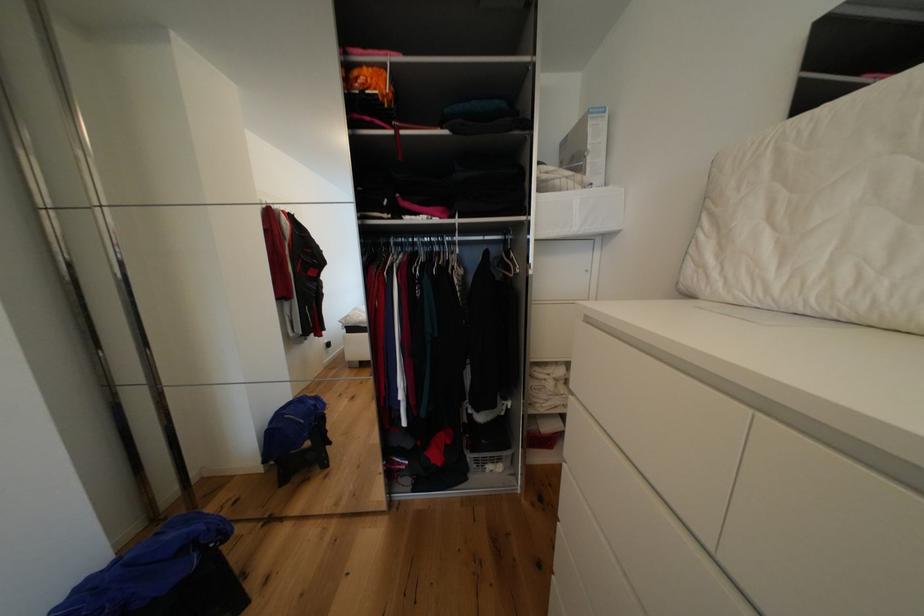
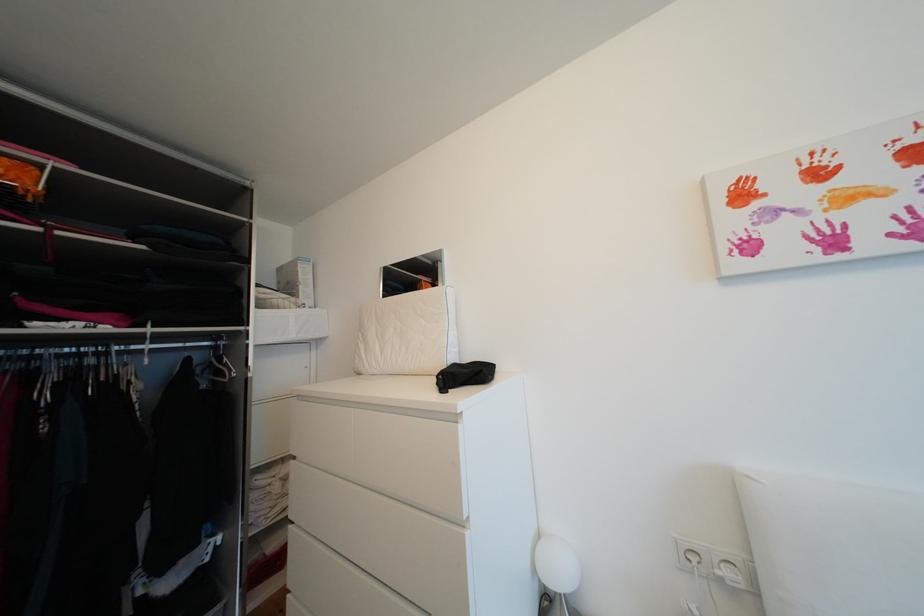
Find the pixel in the second image that matches [708,267] in the first image.

(368, 359)